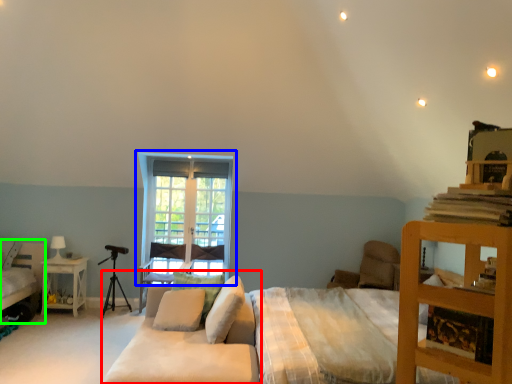
Question: Which object is the farthest from studio couch (highlighted by a red box)? Choose among these: window (highlighted by a blue box) or bed (highlighted by a green box).

Choices:
 (A) window
 (B) bed

Answer: (B)